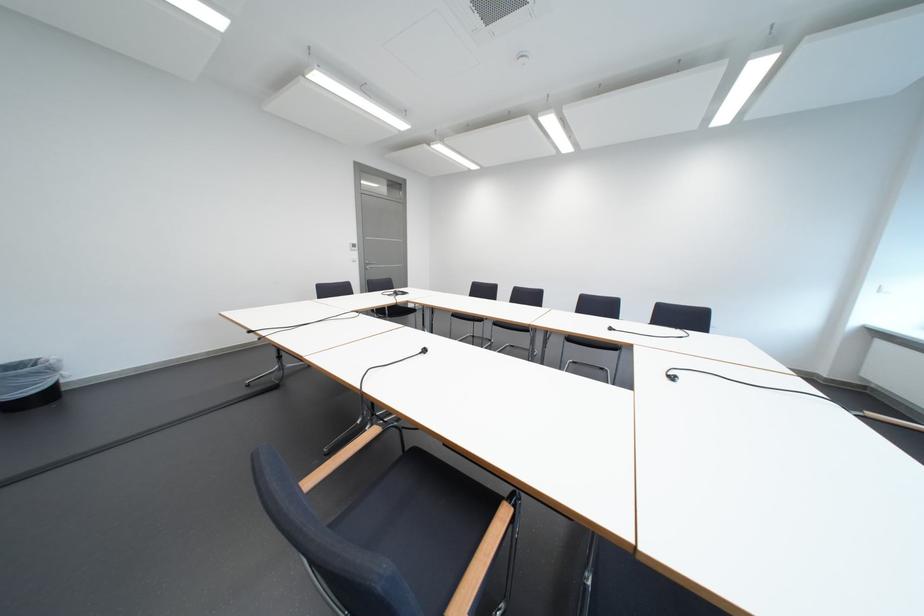
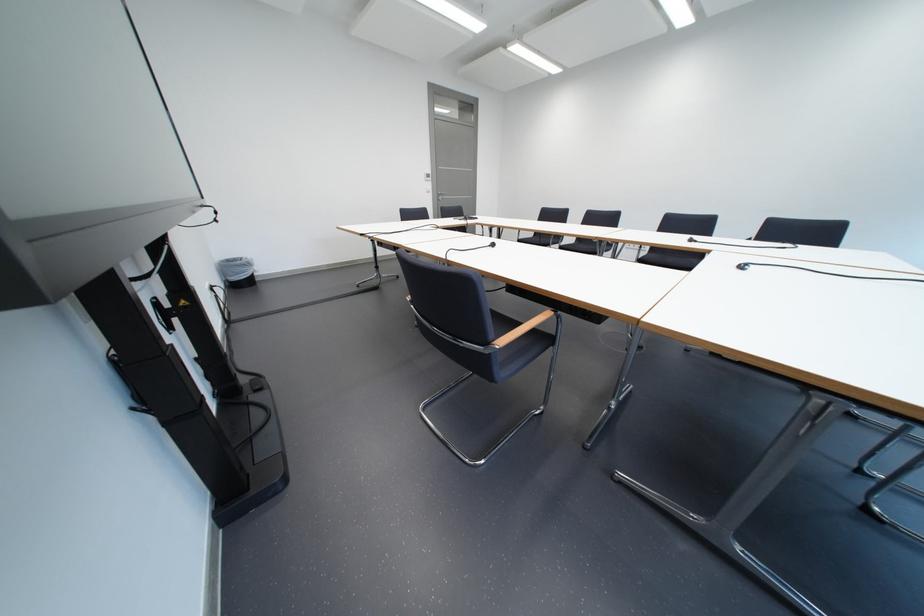
Question: The camera is either moving clockwise (left) or counter-clockwise (right) around the object. The first image is from the beginning of the video and the second image is from the end. Is the camera moving left or right when shooting the video?

Choices:
 (A) Left
 (B) Right

Answer: (B)